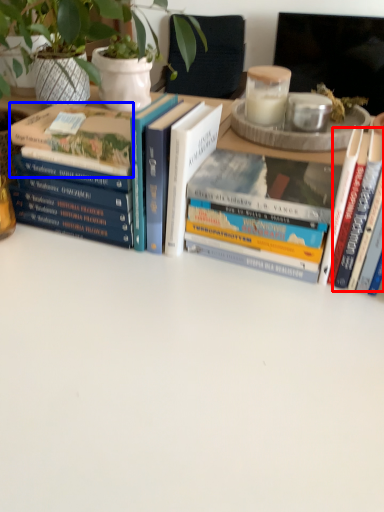
Question: Which object appears closest to the camera in this image, book (highlighted by a red box) or book (highlighted by a blue box)?

Choices:
 (A) book
 (B) book

Answer: (A)